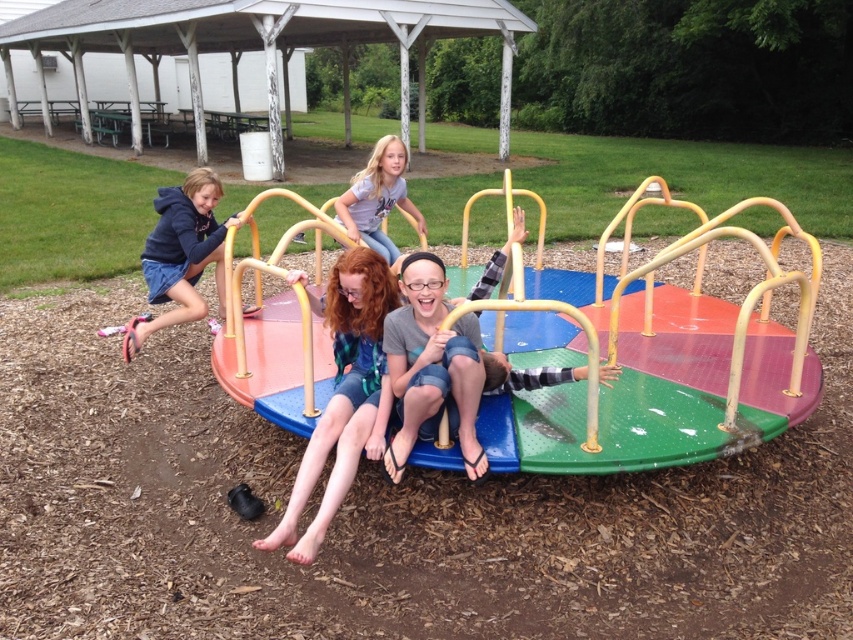
You are a parent supervising children on the merry go round. You need to ensure that the shorter child can reach the yellow metal bars. Which child should you help first, the one wearing the matte green shorts at center or the matte black hoodie at left?

The matte green shorts at center is not as tall as matte black hoodie at left, so you should help the child wearing the matte green shorts at center first since they are shorter and may need assistance reaching the yellow metal bars.

You are standing at the center of the merry go round and see two points marked on the edge. One is at point (467, 328) and the other is at point (404, 157). Which point is closer to you?

Point (467, 328) is in front of point (404, 157), so it is closer to you.

You are a photographer standing at the edge of the merry go round. You want to take a photo of the matte green shorts at center. Your camera has a focal length of 50mm and the recommended distance for clear photos is 10 feet. Can you take a clear photo from your current position?

The distance between you and the matte green shorts at center is 10.67 feet, which is slightly beyond the recommended 10 feet. You might need to move closer or adjust your camera settings for a clearer photo.